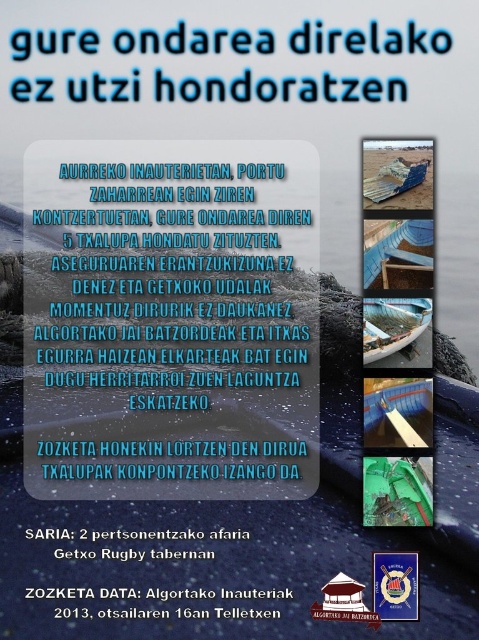
Question: Is white paper at center closer to the viewer compared to blue plastic boat at upper center?

Choices:
 (A) no
 (B) yes

Answer: (B)

Question: Estimate the real-world distances between objects in this image. Which object is farther from the green plastic boat at center?

Choices:
 (A) white paper at center
 (B) black paper text at lower center
 (C) blue plastic text at upper center
 (D) blue plastic boat at center

Answer: (C)

Question: Which of these objects is positioned closest to the wooden boat at upper center?

Choices:
 (A) white paper at center
 (B) blue plastic text at upper center
 (C) blue plastic boat at center

Answer: (B)

Question: Where is blue plastic text at upper center located in relation to blue plastic boat at center in the image?

Choices:
 (A) left
 (B) right

Answer: (A)

Question: Does green plastic boat at center lie behind blue corrugated metal boat at upper center?

Choices:
 (A) no
 (B) yes

Answer: (A)

Question: Which of the following is the closest to the observer?

Choices:
 (A) (230, 596)
 (B) (306, 240)
 (C) (236, 93)
 (D) (410, 515)

Answer: (A)